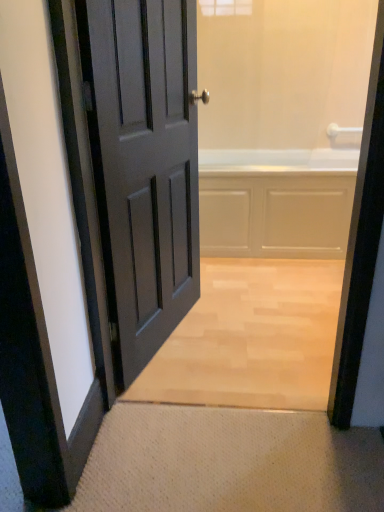
Question: Can you confirm if white textured mat at lower center is wider than matte gray door at left?

Choices:
 (A) no
 (B) yes

Answer: (B)

Question: From the image's perspective, does white textured mat at lower center appear higher than matte gray door at left?

Choices:
 (A) yes
 (B) no

Answer: (B)

Question: Is white textured mat at lower center not within matte gray door at left?

Choices:
 (A) yes
 (B) no

Answer: (A)

Question: Does white textured mat at lower center have a lesser height compared to matte gray door at left?

Choices:
 (A) yes
 (B) no

Answer: (A)

Question: Is white textured mat at lower center turned away from matte gray door at left?

Choices:
 (A) yes
 (B) no

Answer: (B)

Question: Is matte gray door at left a part of white textured mat at lower center?

Choices:
 (A) yes
 (B) no

Answer: (B)

Question: Is matte gray door at left far away from white glossy bathtub at center?

Choices:
 (A) no
 (B) yes

Answer: (A)

Question: Does matte gray door at left have a greater width compared to white glossy bathtub at center?

Choices:
 (A) yes
 (B) no

Answer: (B)

Question: From the image's perspective, is matte gray door at left beneath white glossy bathtub at center?

Choices:
 (A) no
 (B) yes

Answer: (B)

Question: Is matte gray door at left next to white glossy bathtub at center and touching it?

Choices:
 (A) yes
 (B) no

Answer: (B)

Question: Can you confirm if matte gray door at left is taller than white glossy bathtub at center?

Choices:
 (A) no
 (B) yes

Answer: (B)

Question: Is matte gray door at left to the right of white glossy bathtub at center from the viewer's perspective?

Choices:
 (A) yes
 (B) no

Answer: (B)

Question: Is matte gray door at left bigger than white textured mat at lower center?

Choices:
 (A) no
 (B) yes

Answer: (B)